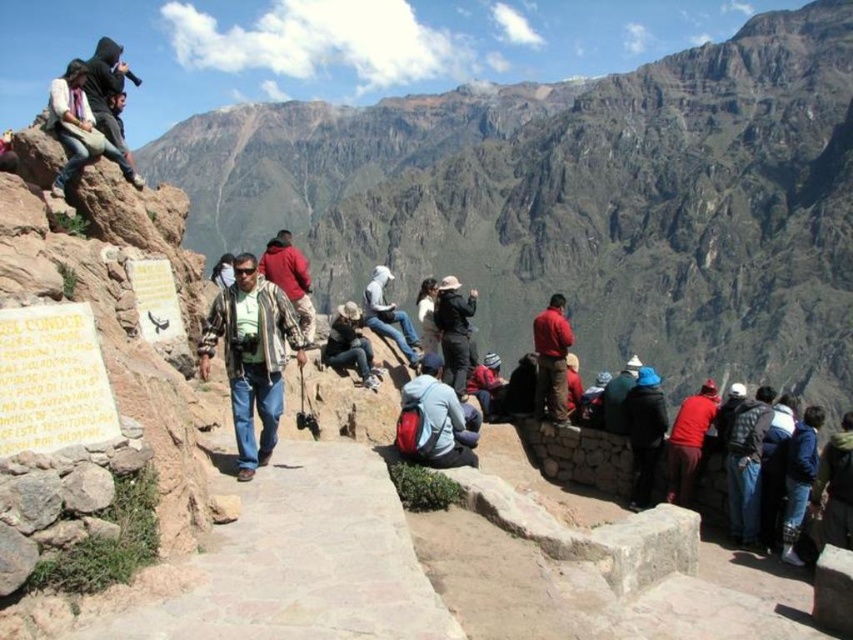
Between red backpack at center and dark blue jeans at lower right, which one has less height?

With less height is red backpack at center.

Is point (419, 372) behind point (737, 454)?

Yes, it is behind point (737, 454).

Find the location of a particular element. The image size is (853, 640). red backpack at center is located at coordinates (434, 420).

Is point (689, 420) closer to viewer compared to point (358, 337)?

Yes.

Which is behind, point (691, 428) or point (352, 353)?

Point (352, 353)

Find the location of `red wool sweater at center`. red wool sweater at center is located at coordinates (688, 442).

Does dark blue jacket at center appear on the left side of dark gray jacket at center?

No, dark blue jacket at center is not to the left of dark gray jacket at center.

Who is shorter, dark blue jacket at center or dark gray jacket at center?

With less height is dark blue jacket at center.

Is point (643, 436) positioned in front of point (456, 284)?

That is True.

Find the location of a particular element. The image size is (853, 640). dark blue jacket at center is located at coordinates (643, 433).